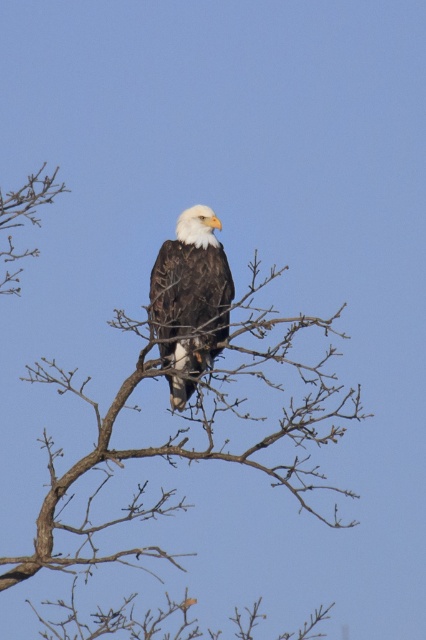
You are a photographer trying to capture the bald eagle in the image. The eagle is perched on a brown wood tree branch at center. You want to place the eagle exactly at the center of your viewfinder using the rule of thirds grid. The rule of thirds grid has four intersection points, one of which is at point coordinates approximately [181,445]. Is the brown wood tree branch at center located at this intersection point?

Yes, the point at coordinates [181,445] indicates the location of the brown wood tree branch at center, so the eagle is positioned at that intersection point according to the rule of thirds grid.